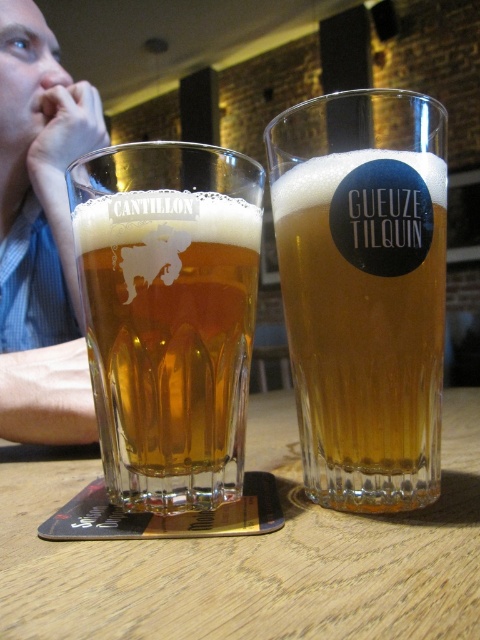
You are a bartender who needs to serve a drink to a customer. The customer points to a spot on the table and says, I want the beer at this point. The coordinates given are point (363,291). Based on the scene, which beer should you serve?

The point (363,291) indicates clear glass beer at center, so you should serve the clear glass beer at center.

You are at a Belgian beer festival and see the clear glass beer at center. Where exactly is it positioned relative to the table?

The clear glass beer at center is located at point 0.455 along the horizontal axis and 0.758 along the vertical axis on the table.

You are at a bar and want to order a drink. You see two beers on the table. The clear glass beer at center and the translucent glass cantillon beer at left. Which one is positioned to the right of the other?

The clear glass beer at center is to the right of the translucent glass cantillon beer at left.